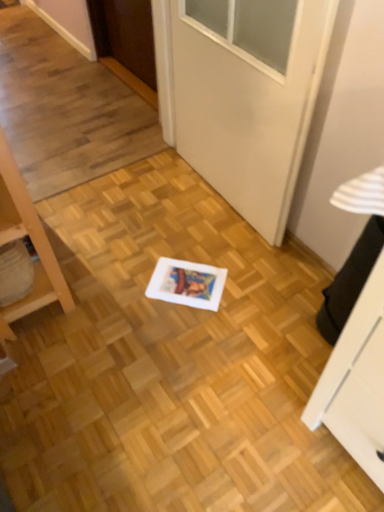
Locate an element on the screen. The width and height of the screenshot is (384, 512). vacant area that is in front of white glossy door at center is located at coordinates (217, 269).